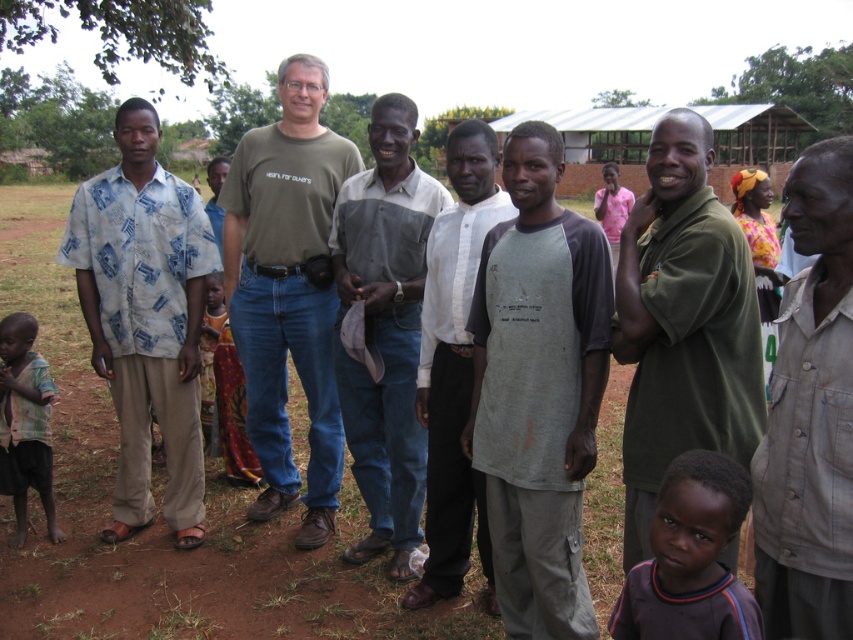
Question: In this image, where is gray fabric shirt at center located relative to dark gray shirt at lower right?

Choices:
 (A) right
 (B) left

Answer: (B)

Question: Can you confirm if gray cotton shirt at center is smaller than plaid fabric shirt at lower left?

Choices:
 (A) no
 (B) yes

Answer: (A)

Question: Among these points, which one is farthest from the camera?

Choices:
 (A) (212, 339)
 (B) (459, 221)
 (C) (653, 234)
 (D) (564, 598)

Answer: (A)

Question: Which point is closer to the camera?

Choices:
 (A) (30, 397)
 (B) (740, 234)
 (C) (814, 337)
 (D) (469, 454)

Answer: (C)

Question: Which point is farther to the camera?

Choices:
 (A) printed fabric shirt at left
 (B) green matte shirt at center

Answer: (A)

Question: Can you confirm if printed fabric shirt at left is smaller than dark gray shirt at lower right?

Choices:
 (A) no
 (B) yes

Answer: (A)